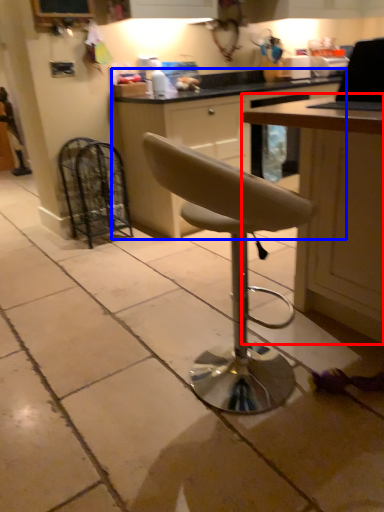
Question: Which of the following is the closest to the observer, table (highlighted by a red box) or cabinetry (highlighted by a blue box)?

Choices:
 (A) table
 (B) cabinetry

Answer: (A)